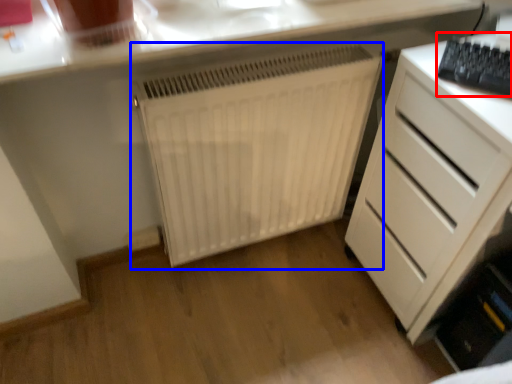
Question: Which of the following is the farthest to the observer, keyboard (highlighted by a red box) or radiator (highlighted by a blue box)?

Choices:
 (A) keyboard
 (B) radiator

Answer: (B)